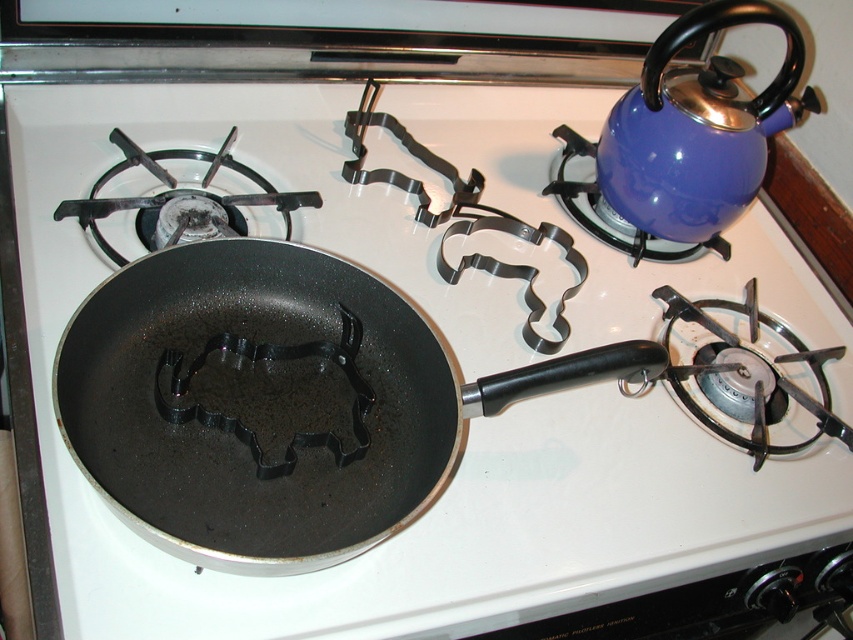
Question: Can you confirm if non-stick black frying pan at center is positioned below blue enamel kettle at upper right?

Choices:
 (A) yes
 (B) no

Answer: (A)

Question: Can you confirm if non-stick black frying pan at center is smaller than blue enamel kettle at upper right?

Choices:
 (A) no
 (B) yes

Answer: (B)

Question: Which point appears farthest from the camera in this image?

Choices:
 (A) (126, 352)
 (B) (650, 72)

Answer: (B)

Question: Can you confirm if non-stick black frying pan at center is positioned above blue enamel kettle at upper right?

Choices:
 (A) no
 (B) yes

Answer: (A)

Question: Which object appears farthest from the camera in this image?

Choices:
 (A) blue enamel kettle at upper right
 (B) non-stick black frying pan at center

Answer: (A)